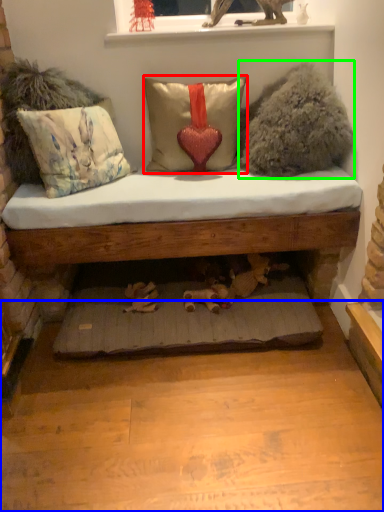
Question: Estimate the real-world distances between objects in this image. Which object is farther from pillow (highlighted by a red box), platform (highlighted by a blue box) or animal (highlighted by a green box)?

Choices:
 (A) platform
 (B) animal

Answer: (A)